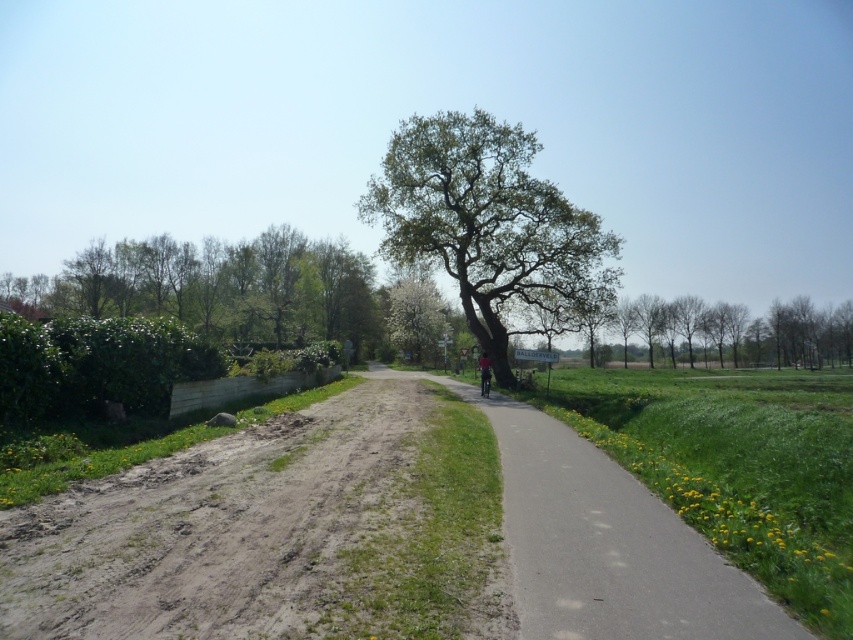
You are a hiker trying to decide which path to take. You see the brown dirt track at lower left and the green leafy tree at center. Which path is narrower?

The brown dirt track at lower left is thinner than the green leafy tree at center, so the brown dirt track at lower left is narrower.

You are a hiker standing at the start of the path. You want to reach the green leafy tree at center. Which direction should you walk to avoid the brown dirt track at lower left?

The brown dirt track at lower left is in front of the green leafy tree at center, so to avoid it, walk towards the right side of the path where the lush greenery and flowers are located instead of following the brown dirt track at lower left.